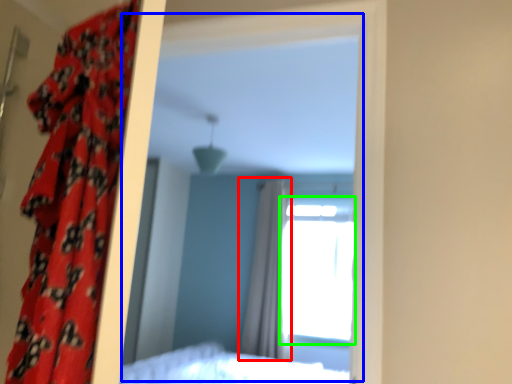
Question: Which is nearer to the curtain (highlighted by a red box)? mirror (highlighted by a blue box) or window (highlighted by a green box).

Choices:
 (A) mirror
 (B) window

Answer: (B)